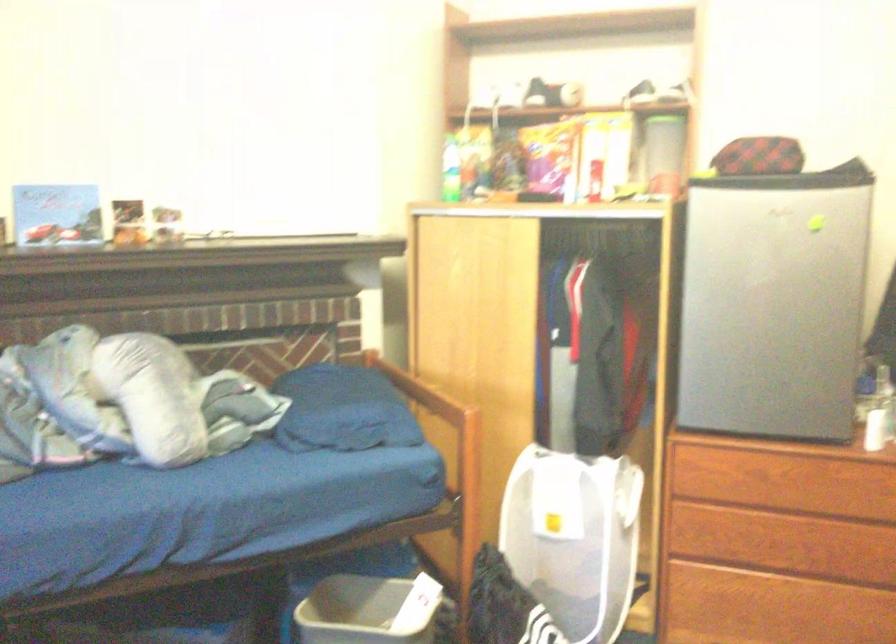
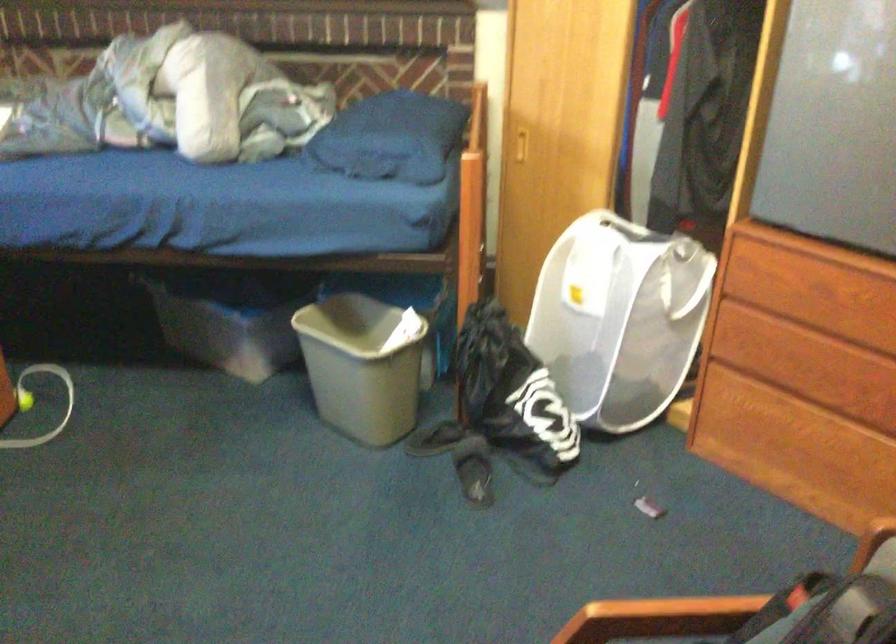
First-person continuous shooting, in which direction is the camera rotating?

The camera rotated toward left-down.